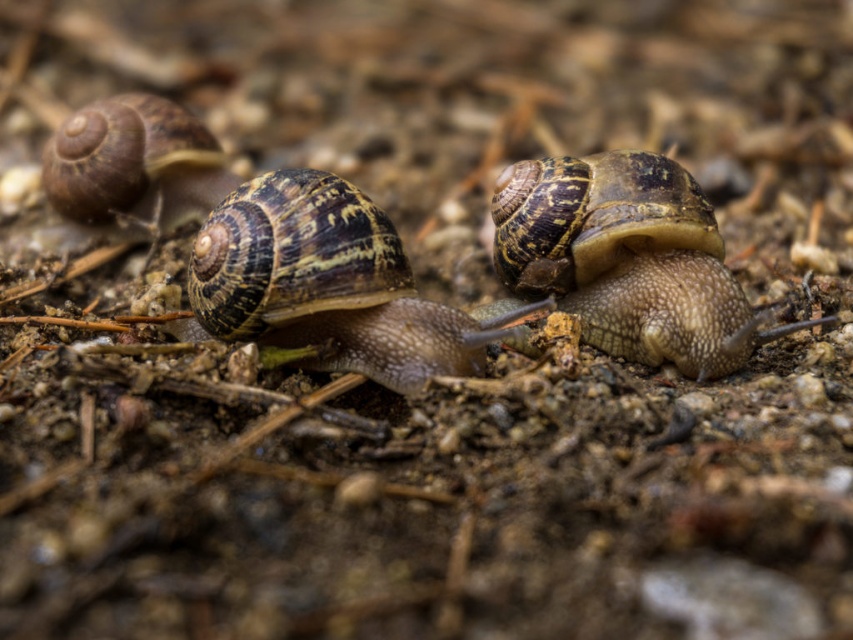
Question: Among these points, which one is nearest to the camera?

Choices:
 (A) (126, 99)
 (B) (636, 253)
 (C) (328, 356)

Answer: (C)

Question: Which object is positioned farthest from the shiny brown shell at left?

Choices:
 (A) shiny brown shell at center
 (B) shiny brown snail at center

Answer: (B)

Question: Is shiny brown snail at center bigger than shiny brown shell at left?

Choices:
 (A) yes
 (B) no

Answer: (A)

Question: Can you confirm if shiny brown shell at center is wider than shiny brown shell at left?

Choices:
 (A) no
 (B) yes

Answer: (B)

Question: Is shiny brown snail at center positioned at the back of shiny brown shell at left?

Choices:
 (A) yes
 (B) no

Answer: (B)

Question: Which object appears farthest from the camera in this image?

Choices:
 (A) shiny brown shell at center
 (B) shiny brown snail at center

Answer: (B)